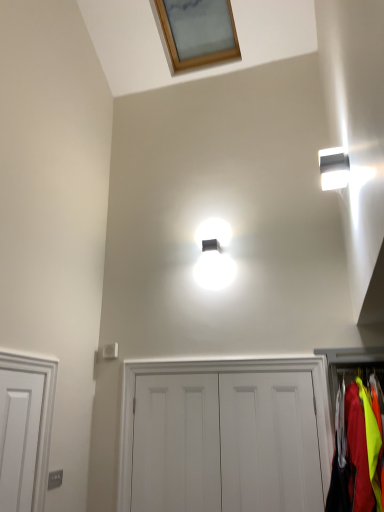
Question: Is white matte door at center, acting as the 2th door starting from the left, not near white glossy light fixture at upper right?

Choices:
 (A) no
 (B) yes

Answer: (B)

Question: Is white matte door at center, acting as the 2th door starting from the left, aimed at white glossy light fixture at upper right?

Choices:
 (A) no
 (B) yes

Answer: (A)

Question: Can you confirm if white matte door at center, acting as the 2th door starting from the right, is taller than white glossy light fixture at upper right?

Choices:
 (A) yes
 (B) no

Answer: (A)

Question: Is white matte door at center, acting as the 2th door starting from the right, positioned behind white glossy light fixture at upper right?

Choices:
 (A) yes
 (B) no

Answer: (A)

Question: Can you confirm if white matte door at center, acting as the 2th door starting from the right, is thinner than white glossy light fixture at upper right?

Choices:
 (A) no
 (B) yes

Answer: (B)

Question: Considering the relative positions of white matte door at center, acting as the 2th door starting from the right, and white glossy light fixture at upper right in the image provided, is white matte door at center, acting as the 2th door starting from the right, to the right of white glossy light fixture at upper right from the viewer's perspective?

Choices:
 (A) no
 (B) yes

Answer: (A)

Question: Is white glossy light fixture at upper right positioned before neon yellow fabric at right?

Choices:
 (A) no
 (B) yes

Answer: (A)

Question: Is white glossy light fixture at upper right in contact with neon yellow fabric at right?

Choices:
 (A) yes
 (B) no

Answer: (B)

Question: From a real-world perspective, does white glossy light fixture at upper right stand above neon yellow fabric at right?

Choices:
 (A) no
 (B) yes

Answer: (B)

Question: Is white glossy light fixture at upper right wider than neon yellow fabric at right?

Choices:
 (A) yes
 (B) no

Answer: (B)

Question: Is white glossy light fixture at upper right facing towards neon yellow fabric at right?

Choices:
 (A) no
 (B) yes

Answer: (A)

Question: Does white glossy light fixture at upper right have a lesser height compared to neon yellow fabric at right?

Choices:
 (A) yes
 (B) no

Answer: (A)

Question: Can you confirm if white matte door at center, acting as the 2th door starting from the left, is smaller than wooden frame at upper center?

Choices:
 (A) no
 (B) yes

Answer: (B)